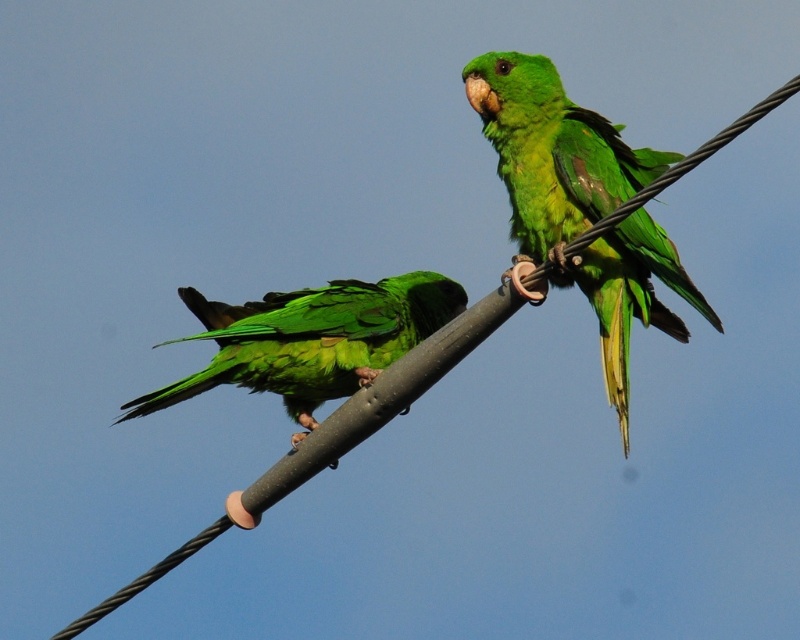
You are a birdwatcher observing two green matte parrots in the image. Which parrot is positioned higher in the sky between the green matte parrot at upper right and the green matte parrot at left?

The green matte parrot at upper right is located above the green matte parrot at left, so it is positioned higher in the sky.

From the picture: You are a birdwatcher trying to identify the parrots in the image. Which parrot, the green matte parrot at upper right or the green matte parrot at left, is smaller in size?

The green matte parrot at upper right is smaller than the green matte parrot at left according to the description provided.

You are a birdwatcher observing two green matte parrots in the sky. You notice the green matte parrot at upper right and the green matte parrot at left. Which parrot is located to the right of the other?

The green matte parrot at upper right is positioned on the right side of the green matte parrot at left.